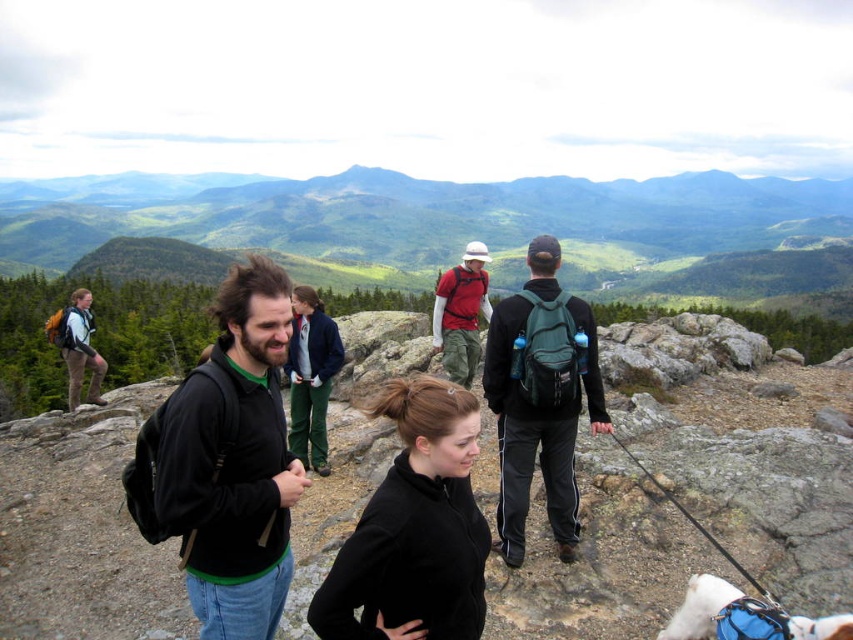
Between black matte jacket at center and black matte sweater at center, which one has less height?

Standing shorter between the two is black matte sweater at center.

Does black matte jacket at center have a larger size compared to black matte sweater at center?

Indeed, black matte jacket at center has a larger size compared to black matte sweater at center.

The height and width of the screenshot is (640, 853). Describe the element at coordinates (234, 461) in the screenshot. I see `black matte jacket at center` at that location.

Locate an element on the screen. black matte jacket at center is located at coordinates (234, 461).

Does point (550, 445) lie in front of point (444, 320)?

Yes, it is.

Can you confirm if green matte backpack at center-right is bigger than matte red shirt at center?

No, green matte backpack at center-right is not bigger than matte red shirt at center.

Where is `green matte backpack at center-right`? The image size is (853, 640). green matte backpack at center-right is located at coordinates (540, 403).

I want to click on green matte backpack at center-right, so click(540, 403).

Who is higher up, green grassy mountain at upper center or matte red shirt at center?

green grassy mountain at upper center is above.

Is green grassy mountain at upper center wider than matte red shirt at center?

Yes.

Which is in front, point (225, 221) or point (436, 301)?

Point (436, 301)

What are the coordinates of `green grassy mountain at upper center` in the screenshot? It's located at (451, 224).